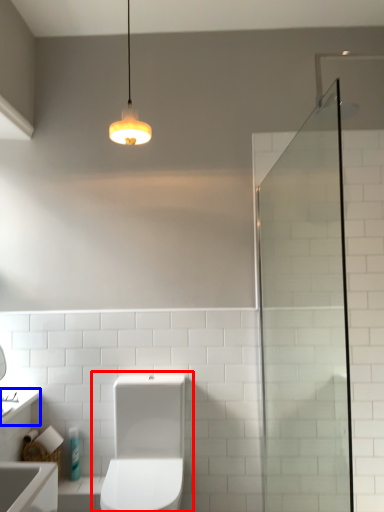
Question: Which object appears farthest to the camera in this image, toilet (highlighted by a red box) or counter top (highlighted by a blue box)?

Choices:
 (A) toilet
 (B) counter top

Answer: (B)